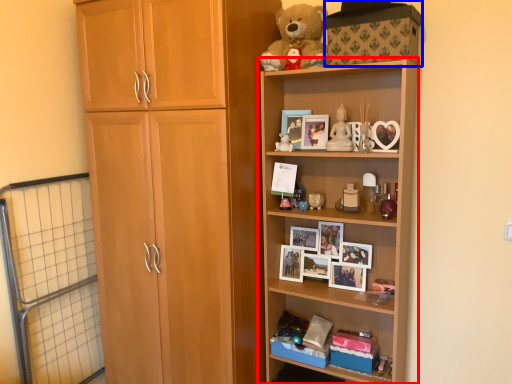
Question: Among these objects, which one is farthest to the camera, shelf (highlighted by a red box) or storage box (highlighted by a blue box)?

Choices:
 (A) shelf
 (B) storage box

Answer: (A)